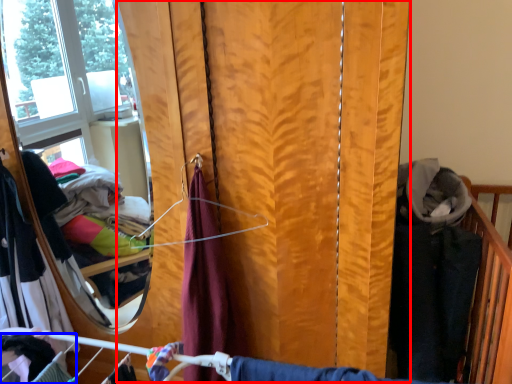
Question: Which of the following is the farthest to the observer, curtain (highlighted by a red box) or clothing (highlighted by a blue box)?

Choices:
 (A) curtain
 (B) clothing

Answer: (A)